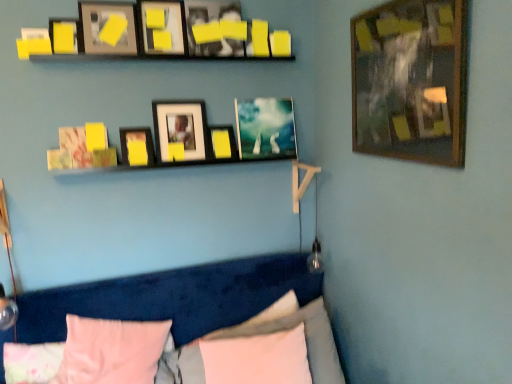
What do you see at coordinates (411, 81) in the screenshot?
I see `wooden framed picture at upper right, the 10th picture frame in the left-to-right sequence` at bounding box center [411, 81].

In order to face matte black picture frame at upper center, the 7th picture frame positioned from the right, should I rotate leftwards or rightwards?

Turn left by 15.853 degrees to look at matte black picture frame at upper center, the 7th picture frame positioned from the right.

Locate an element on the screen. Image resolution: width=512 pixels, height=384 pixels. pink fabric pillow at lower center, marked as the fifth pillow in a left-to-right arrangement is located at coordinates (264, 315).

Measure the distance between matte paper picture frame at upper left, arranged as the ninth picture frame when viewed from the right, and camera.

The distance of matte paper picture frame at upper left, arranged as the ninth picture frame when viewed from the right, from camera is 1.85 meters.

What do you see at coordinates (82, 148) in the screenshot?
I see `matte paper picture frame at upper left, which appears as the 2th picture frame when viewed from the left` at bounding box center [82, 148].

How much space does matte black picture frame at center, placed as the 6th picture frame when sorted from left to right, occupy horizontally?

The width of matte black picture frame at center, placed as the 6th picture frame when sorted from left to right, is 3.24 inches.

Find the location of a particular element. This screenshot has height=384, width=512. pink fabric pillow at lower center, the 3th pillow in the right-to-left sequence is located at coordinates (31, 362).

I want to click on pink fabric pillow at lower left, which appears as the 1th pillow when viewed from the left, so click(31, 362).

Find the location of a particular element. white soft pillow at lower center, positioned as the second pillow in right-to-left order is located at coordinates (257, 359).

From a real-world perspective, is yellow matte picture frame at upper center, acting as the fifth picture frame starting from the left, positioned over pink fabric pillow at lower center, which is the third pillow in left-to-right order, based on gravity?

Yes, from a real-world perspective, yellow matte picture frame at upper center, acting as the fifth picture frame starting from the left, is over pink fabric pillow at lower center, which is the third pillow in left-to-right order

From the image's perspective, would you say yellow matte picture frame at upper center, acting as the fifth picture frame starting from the left, is positioned over pink fabric pillow at lower center, which is the third pillow in left-to-right order?

Yes, from the image's perspective, yellow matte picture frame at upper center, acting as the fifth picture frame starting from the left, is on top of pink fabric pillow at lower center, which is the third pillow in left-to-right order.

Considering the sizes of yellow matte picture frame at upper center, acting as the fifth picture frame starting from the left, and pink fabric pillow at lower center, the 3th pillow in the right-to-left sequence, in the image, is yellow matte picture frame at upper center, acting as the fifth picture frame starting from the left, bigger or smaller than pink fabric pillow at lower center, the 3th pillow in the right-to-left sequence,?

In the image, yellow matte picture frame at upper center, acting as the fifth picture frame starting from the left, appears to be smaller than pink fabric pillow at lower center, the 3th pillow in the right-to-left sequence.

Which is more to the left, yellow matte picture frame at upper center, placed as the 6th picture frame when sorted from right to left, or pink fabric pillow at lower center, the 3th pillow in the right-to-left sequence?

pink fabric pillow at lower center, the 3th pillow in the right-to-left sequence.

Does matte black picture frame at upper center, the 4th picture frame viewed from the right, come in front of matte black picture frame at upper center, the 4th picture frame in the left-to-right sequence?

Yes, it is in front of matte black picture frame at upper center, the 4th picture frame in the left-to-right sequence.

Considering the positions of objects matte black picture frame at upper center, which appears as the 7th picture frame when viewed from the left, and matte black picture frame at upper center, the 7th picture frame positioned from the right, in the image provided, who is more to the left, matte black picture frame at upper center, which appears as the 7th picture frame when viewed from the left, or matte black picture frame at upper center, the 7th picture frame positioned from the right,?

From the viewer's perspective, matte black picture frame at upper center, the 7th picture frame positioned from the right, appears more on the left side.

Is matte black picture frame at upper center, which appears as the 7th picture frame when viewed from the left, oriented away from matte black picture frame at upper center, the 7th picture frame positioned from the right?

No, matte black picture frame at upper center, which appears as the 7th picture frame when viewed from the left,'s orientation is not away from matte black picture frame at upper center, the 7th picture frame positioned from the right.

Who is taller, pink fabric pillow at lower left, which appears as the 1th pillow when viewed from the left, or pink fabric pillow at lower left, which is the second pillow from left to right?

With more height is pink fabric pillow at lower left, which is the second pillow from left to right.

From the image's perspective, is pink fabric pillow at lower left, which appears as the 1th pillow when viewed from the left, located above or below pink fabric pillow at lower left, which is the second pillow from left to right?

Based on their image positions, pink fabric pillow at lower left, which appears as the 1th pillow when viewed from the left, is located beneath pink fabric pillow at lower left, which is the second pillow from left to right.

From a real-world perspective, is pink fabric pillow at lower left, which is the fifth pillow from right to left, under pink fabric pillow at lower left, the fourth pillow viewed from the right?

Yes, from a real-world perspective, pink fabric pillow at lower left, which is the fifth pillow from right to left, is under pink fabric pillow at lower left, the fourth pillow viewed from the right.

Is pink fabric pillow at lower left, which appears as the 1th pillow when viewed from the left, aimed at pink fabric pillow at lower left, the fourth pillow viewed from the right?

Yes, pink fabric pillow at lower left, which appears as the 1th pillow when viewed from the left, is oriented towards pink fabric pillow at lower left, the fourth pillow viewed from the right.

From the pink fabric pillow at lower center, the 3th pillow in the right-to-left sequence, count 1st picture frames backward and point to it. Please provide its 2D coordinates.

[(64, 35)]

Which of these two, pink fabric pillow at lower center, which is the third pillow in left-to-right order, or matte yellow picture frame at upper left, placed as the 10th picture frame when sorted from right to left, stands taller?

pink fabric pillow at lower center, which is the third pillow in left-to-right order, is taller.

Is pink fabric pillow at lower center, which is the third pillow in left-to-right order, wider than matte yellow picture frame at upper left, placed as the 1th picture frame when sorted from left to right?

Correct, the width of pink fabric pillow at lower center, which is the third pillow in left-to-right order, exceeds that of matte yellow picture frame at upper left, placed as the 1th picture frame when sorted from left to right.

Which is behind, point (4, 350) or point (65, 41)?

Positioned behind is point (4, 350).

This screenshot has width=512, height=384. I want to click on the 1st picture frame counting from the right of the matte black picture frame at upper center, the 4th picture frame in the left-to-right sequence, so click(162, 28).

Is yellow matte picture frame at upper center, placed as the 6th picture frame when sorted from right to left, completely or partially outside of matte black picture frame at upper center, the 4th picture frame in the left-to-right sequence?

Indeed, yellow matte picture frame at upper center, placed as the 6th picture frame when sorted from right to left, is completely outside matte black picture frame at upper center, the 4th picture frame in the left-to-right sequence.

Is yellow matte picture frame at upper center, acting as the fifth picture frame starting from the left, wider or thinner than matte black picture frame at upper center, the 7th picture frame positioned from the right?

Clearly, yellow matte picture frame at upper center, acting as the fifth picture frame starting from the left, has less width compared to matte black picture frame at upper center, the 7th picture frame positioned from the right.

Measure the distance between yellow matte picture frame at upper center, placed as the 6th picture frame when sorted from right to left, and matte black picture frame at upper center, the 4th picture frame in the left-to-right sequence.

yellow matte picture frame at upper center, placed as the 6th picture frame when sorted from right to left, is 17.59 inches away from matte black picture frame at upper center, the 4th picture frame in the left-to-right sequence.

Measure the distance between matte black picture frame at upper center, which is the eighth picture frame from right to left, and yellow matte picture frame at upper center, which appears as the 8th picture frame when viewed from the left.

23.99 inches.

Would you say yellow matte picture frame at upper center, which appears as the 8th picture frame when viewed from the left, is part of matte black picture frame at upper center, acting as the third picture frame starting from the left,'s contents?

No, yellow matte picture frame at upper center, which appears as the 8th picture frame when viewed from the left, is not inside matte black picture frame at upper center, acting as the third picture frame starting from the left.

Can you confirm if matte black picture frame at upper center, acting as the third picture frame starting from the left, is wider than yellow matte picture frame at upper center, which appears as the 8th picture frame when viewed from the left?

Yes, matte black picture frame at upper center, acting as the third picture frame starting from the left, is wider than yellow matte picture frame at upper center, which appears as the 8th picture frame when viewed from the left.

Is matte black picture frame at upper center, acting as the third picture frame starting from the left, to the right of yellow matte picture frame at upper center, which appears as the 8th picture frame when viewed from the left, from the viewer's perspective?

In fact, matte black picture frame at upper center, acting as the third picture frame starting from the left, is to the left of yellow matte picture frame at upper center, which appears as the 8th picture frame when viewed from the left.

Is metallic silver picture frame at center, the ninth picture frame positioned from the left, directly adjacent to matte yellow picture frame at upper left, placed as the 1th picture frame when sorted from left to right?

metallic silver picture frame at center, the ninth picture frame positioned from the left, and matte yellow picture frame at upper left, placed as the 1th picture frame when sorted from left to right, are clearly separated.

From a real-world perspective, is metallic silver picture frame at center, the ninth picture frame positioned from the left, physically located above or below matte yellow picture frame at upper left, placed as the 1th picture frame when sorted from left to right?

metallic silver picture frame at center, the ninth picture frame positioned from the left, is situated lower than matte yellow picture frame at upper left, placed as the 1th picture frame when sorted from left to right, in the real world.

Does metallic silver picture frame at center, the ninth picture frame positioned from the left, have a lesser width compared to matte yellow picture frame at upper left, placed as the 1th picture frame when sorted from left to right?

No, metallic silver picture frame at center, the ninth picture frame positioned from the left, is not thinner than matte yellow picture frame at upper left, placed as the 1th picture frame when sorted from left to right.

From the image's perspective, who appears lower, metallic silver picture frame at center, the ninth picture frame positioned from the left, or matte yellow picture frame at upper left, placed as the 1th picture frame when sorted from left to right?

metallic silver picture frame at center, the ninth picture frame positioned from the left, appears lower in the image.

Starting from the pink fabric pillow at lower center, the 3th pillow in the right-to-left sequence, which picture frame is the 4th one behind? Please provide its 2D coordinates.

[(162, 28)]

From a real-world perspective, count 8th picture frames upward from the matte black picture frame at upper center, the 7th picture frame positioned from the right, and point to it. Please provide its 2D coordinates.

[(212, 28)]

Which object lies nearer to the anchor point pink fabric pillow at lower center, which is counted as the first pillow, starting from the right, matte black picture frame at upper center, which is the eighth picture frame from right to left, or matte black picture frame at upper center, which appears as the 7th picture frame when viewed from the left?

The object closer to pink fabric pillow at lower center, which is counted as the first pillow, starting from the right, is matte black picture frame at upper center, which appears as the 7th picture frame when viewed from the left.

Which object lies further to the anchor point matte black picture frame at upper center, the 4th picture frame viewed from the right, matte black picture frame at upper center, the 4th picture frame in the left-to-right sequence, or matte paper picture frame at upper left, arranged as the ninth picture frame when viewed from the right?

matte paper picture frame at upper left, arranged as the ninth picture frame when viewed from the right, is positioned further to the anchor matte black picture frame at upper center, the 4th picture frame viewed from the right.

Which object lies further to the anchor point matte black picture frame at center, placed as the fifth picture frame when sorted from right to left, matte black picture frame at upper center, the 7th picture frame positioned from the right, or white soft pillow at lower center, the 4th pillow viewed from the left?

Based on the image, white soft pillow at lower center, the 4th pillow viewed from the left, appears to be further to matte black picture frame at center, placed as the fifth picture frame when sorted from right to left.

From the image, which object appears to be farther from pink fabric pillow at lower left, the fourth pillow viewed from the right, pink fabric pillow at lower left, which appears as the 1th pillow when viewed from the left, or wooden framed picture at upper right, the first picture frame positioned from the right?

wooden framed picture at upper right, the first picture frame positioned from the right, is positioned further to the anchor pink fabric pillow at lower left, the fourth pillow viewed from the right.

Looking at the image, which one is located closer to pink fabric pillow at lower center, which is the third pillow in left-to-right order, wooden framed picture at upper right, the first picture frame positioned from the right, or matte black picture frame at center, placed as the fifth picture frame when sorted from right to left?

The object closer to pink fabric pillow at lower center, which is the third pillow in left-to-right order, is matte black picture frame at center, placed as the fifth picture frame when sorted from right to left.

From the image, which object appears to be nearer to pink fabric pillow at lower center, which is counted as the first pillow, starting from the right, yellow matte picture frame at upper center, which ranks as the third picture frame in right-to-left order, or matte black picture frame at upper center, which is the eighth picture frame from right to left?

Based on the image, yellow matte picture frame at upper center, which ranks as the third picture frame in right-to-left order, appears to be nearer to pink fabric pillow at lower center, which is counted as the first pillow, starting from the right.

From the image, which object appears to be farther from matte black picture frame at upper center, acting as the third picture frame starting from the left, pink fabric pillow at lower left, the fourth pillow viewed from the right, or matte yellow picture frame at upper left, placed as the 10th picture frame when sorted from right to left?

pink fabric pillow at lower left, the fourth pillow viewed from the right, is positioned further to the anchor matte black picture frame at upper center, acting as the third picture frame starting from the left.

Which object lies nearer to the anchor point white soft pillow at lower center, positioned as the second pillow in right-to-left order, matte black picture frame at center, placed as the 6th picture frame when sorted from left to right, or pink fabric pillow at lower left, the fourth pillow viewed from the right?

pink fabric pillow at lower left, the fourth pillow viewed from the right, is positioned closer to the anchor white soft pillow at lower center, positioned as the second pillow in right-to-left order.

Identify the location of picture frame that lies between matte black picture frame at upper center, the 7th picture frame positioned from the right, and pink fabric pillow at lower left, the fourth pillow viewed from the right, from top to bottom. This screenshot has height=384, width=512. (82, 148).

Where is `pillow that lies between matte paper picture frame at upper left, which appears as the 2th picture frame when viewed from the left, and pink fabric pillow at lower left, which is the second pillow from left to right, from top to bottom`? Image resolution: width=512 pixels, height=384 pixels. pillow that lies between matte paper picture frame at upper left, which appears as the 2th picture frame when viewed from the left, and pink fabric pillow at lower left, which is the second pillow from left to right, from top to bottom is located at coordinates (264, 315).

Locate an element on the screen. pillow between matte black picture frame at upper center, the 4th picture frame viewed from the right, and pink fabric pillow at lower left, the fourth pillow viewed from the right, in the up-down direction is located at coordinates (264, 315).

This screenshot has width=512, height=384. What are the coordinates of `pillow between pink fabric pillow at lower left, which appears as the 1th pillow when viewed from the left, and pink fabric pillow at lower center, which is the third pillow in left-to-right order, in the horizontal direction` in the screenshot? It's located at (111, 351).